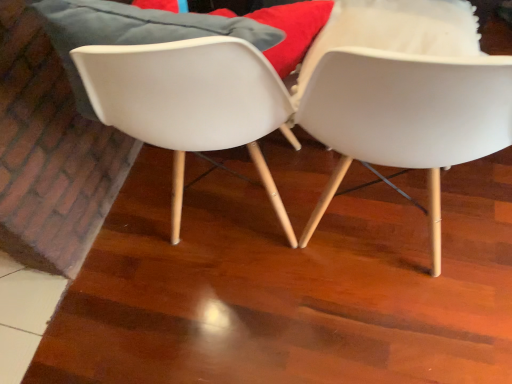
Describe the element at coordinates (406, 117) in the screenshot. The width and height of the screenshot is (512, 384). I see `white matte chair at center, which is counted as the 1th chair, starting from the right` at that location.

In order to face white matte chair at center, positioned as the 2th chair in left-to-right order, should I rotate leftwards or rightwards?

Turn right approximately 19.363 degrees to face it.

Find the location of a particular element. The height and width of the screenshot is (384, 512). white matte chair at center, positioned as the 2th chair in left-to-right order is located at coordinates pos(406,117).

Locate an element on the screen. The width and height of the screenshot is (512, 384). white plastic chair at center, which ranks as the 2th chair in right-to-left order is located at coordinates (190, 102).

Describe the element at coordinates (190, 102) in the screenshot. I see `white plastic chair at center, the first chair viewed from the left` at that location.

This screenshot has height=384, width=512. Find the location of `white matte chair at center, positioned as the 2th chair in left-to-right order`. white matte chair at center, positioned as the 2th chair in left-to-right order is located at coordinates (406, 117).

Which is more to the right, white plastic chair at center, the first chair viewed from the left, or white matte chair at center, which is counted as the 1th chair, starting from the right?

white matte chair at center, which is counted as the 1th chair, starting from the right, is more to the right.

From the picture: Is white plastic chair at center, the first chair viewed from the left, in front of or behind white matte chair at center, positioned as the 2th chair in left-to-right order, in the image?

white plastic chair at center, the first chair viewed from the left, is behind white matte chair at center, positioned as the 2th chair in left-to-right order.

Which point is more forward, (258, 58) or (502, 122)?

The point (258, 58) is closer to the camera.

From the image's perspective, which is below, white plastic chair at center, the first chair viewed from the left, or white matte chair at center, positioned as the 2th chair in left-to-right order?

white matte chair at center, positioned as the 2th chair in left-to-right order.

From a real-world perspective, is white plastic chair at center, the first chair viewed from the left, located higher than white matte chair at center, positioned as the 2th chair in left-to-right order?

No, from a real-world perspective, white plastic chair at center, the first chair viewed from the left, is not over white matte chair at center, positioned as the 2th chair in left-to-right order

Looking at this image, which of these two, white plastic chair at center, the first chair viewed from the left, or white matte chair at center, positioned as the 2th chair in left-to-right order, is thinner?

With smaller width is white matte chair at center, positioned as the 2th chair in left-to-right order.

Can you confirm if white plastic chair at center, the first chair viewed from the left, is shorter than white matte chair at center, positioned as the 2th chair in left-to-right order?

Correct, white plastic chair at center, the first chair viewed from the left, is not as tall as white matte chair at center, positioned as the 2th chair in left-to-right order.

Considering the relative sizes of white plastic chair at center, the first chair viewed from the left, and white matte chair at center, positioned as the 2th chair in left-to-right order, in the image provided, is white plastic chair at center, the first chair viewed from the left, smaller than white matte chair at center, positioned as the 2th chair in left-to-right order,?

Yes, white plastic chair at center, the first chair viewed from the left, is smaller than white matte chair at center, positioned as the 2th chair in left-to-right order.

Is white plastic chair at center, which ranks as the 2th chair in right-to-left order, not within white matte chair at center, positioned as the 2th chair in left-to-right order?

Indeed, white plastic chair at center, which ranks as the 2th chair in right-to-left order, is completely outside white matte chair at center, positioned as the 2th chair in left-to-right order.

Is white plastic chair at center, the first chair viewed from the left, positioned far away from white matte chair at center, which is counted as the 1th chair, starting from the right?

No, white plastic chair at center, the first chair viewed from the left, is in close proximity to white matte chair at center, which is counted as the 1th chair, starting from the right.

Could you tell me if white plastic chair at center, which ranks as the 2th chair in right-to-left order, is turned towards white matte chair at center, which is counted as the 1th chair, starting from the right?

No, white plastic chair at center, which ranks as the 2th chair in right-to-left order, is not facing towards white matte chair at center, which is counted as the 1th chair, starting from the right.

How many degrees apart are the facing directions of white plastic chair at center, the first chair viewed from the left, and white matte chair at center, positioned as the 2th chair in left-to-right order?

The facing directions of white plastic chair at center, the first chair viewed from the left, and white matte chair at center, positioned as the 2th chair in left-to-right order, are 0.000702 degrees apart.

Locate an element on the screen. This screenshot has height=384, width=512. chair on the right of white plastic chair at center, which ranks as the 2th chair in right-to-left order is located at coordinates (406, 117).

Can you confirm if white matte chair at center, which is counted as the 1th chair, starting from the right, is positioned to the right of white plastic chair at center, which ranks as the 2th chair in right-to-left order?

Yes, white matte chair at center, which is counted as the 1th chair, starting from the right, is to the right of white plastic chair at center, which ranks as the 2th chair in right-to-left order.

Between white matte chair at center, positioned as the 2th chair in left-to-right order, and white plastic chair at center, the first chair viewed from the left, which one is positioned in front?

Positioned in front is white matte chair at center, positioned as the 2th chair in left-to-right order.

Which point is more forward, (338, 65) or (146, 97)?

The point (338, 65) is closer to the camera.

From the image's perspective, is white matte chair at center, positioned as the 2th chair in left-to-right order, positioned above or below white plastic chair at center, the first chair viewed from the left?

white matte chair at center, positioned as the 2th chair in left-to-right order, is below white plastic chair at center, the first chair viewed from the left.

From the picture: From a real-world perspective, is white matte chair at center, which is counted as the 1th chair, starting from the right, over white plastic chair at center, which ranks as the 2th chair in right-to-left order?

Yes.

Is white matte chair at center, which is counted as the 1th chair, starting from the right, wider or thinner than white plastic chair at center, which ranks as the 2th chair in right-to-left order?

In the image, white matte chair at center, which is counted as the 1th chair, starting from the right, appears to be more narrow than white plastic chair at center, which ranks as the 2th chair in right-to-left order.

Which of these two, white matte chair at center, positioned as the 2th chair in left-to-right order, or white plastic chair at center, the first chair viewed from the left, stands taller?

white matte chair at center, positioned as the 2th chair in left-to-right order.

Considering the relative sizes of white matte chair at center, which is counted as the 1th chair, starting from the right, and white plastic chair at center, which ranks as the 2th chair in right-to-left order, in the image provided, is white matte chair at center, which is counted as the 1th chair, starting from the right, bigger than white plastic chair at center, which ranks as the 2th chair in right-to-left order,?

Yes.

Is white matte chair at center, which is counted as the 1th chair, starting from the right, outside of white plastic chair at center, which ranks as the 2th chair in right-to-left order?

Yes, white matte chair at center, which is counted as the 1th chair, starting from the right, is located beyond the bounds of white plastic chair at center, which ranks as the 2th chair in right-to-left order.

Are white matte chair at center, which is counted as the 1th chair, starting from the right, and white plastic chair at center, which ranks as the 2th chair in right-to-left order, making contact?

No, white matte chair at center, which is counted as the 1th chair, starting from the right, is not beside white plastic chair at center, which ranks as the 2th chair in right-to-left order.

Consider the image. Is white plastic chair at center, which ranks as the 2th chair in right-to-left order, at the back of white matte chair at center, positioned as the 2th chair in left-to-right order?

No, white matte chair at center, positioned as the 2th chair in left-to-right order,'s orientation is not away from white plastic chair at center, which ranks as the 2th chair in right-to-left order.

How many degrees apart are the facing directions of white matte chair at center, which is counted as the 1th chair, starting from the right, and white plastic chair at center, the first chair viewed from the left?

The facing directions of white matte chair at center, which is counted as the 1th chair, starting from the right, and white plastic chair at center, the first chair viewed from the left, are 0.000702 degrees apart.

Could you measure the distance between white matte chair at center, positioned as the 2th chair in left-to-right order, and white plastic chair at center, the first chair viewed from the left?

9.57 inches.

What are the coordinates of `chair lying below the white plastic chair at center, which ranks as the 2th chair in right-to-left order (from the image's perspective)` in the screenshot? It's located at (406, 117).

Find the location of a particular element. chair on the right of the white plastic chair at center, which ranks as the 2th chair in right-to-left order is located at coordinates (406, 117).

Identify the location of chair in front of the white plastic chair at center, the first chair viewed from the left. This screenshot has width=512, height=384. [x=406, y=117].